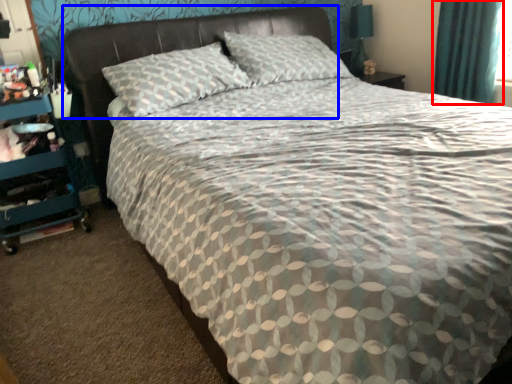
Question: Which of the following is the closest to the observer, curtain (highlighted by a red box) or headboard (highlighted by a blue box)?

Choices:
 (A) curtain
 (B) headboard

Answer: (B)